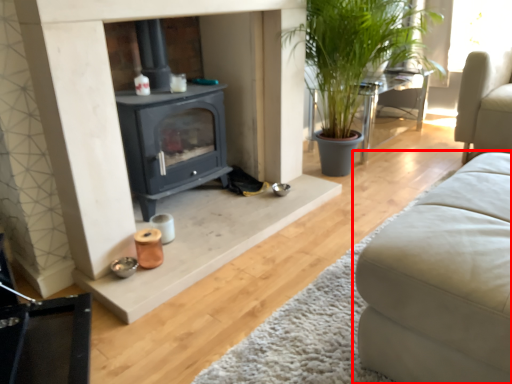
Question: From the image's perspective, what is the correct spatial positioning of studio couch (annotated by the red box) in reference to table?

Choices:
 (A) below
 (B) above

Answer: (A)